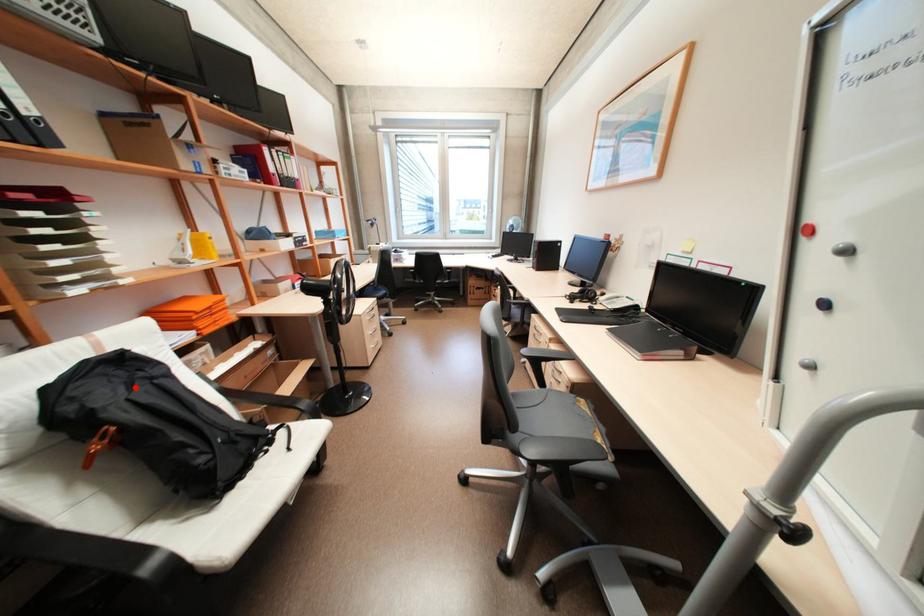
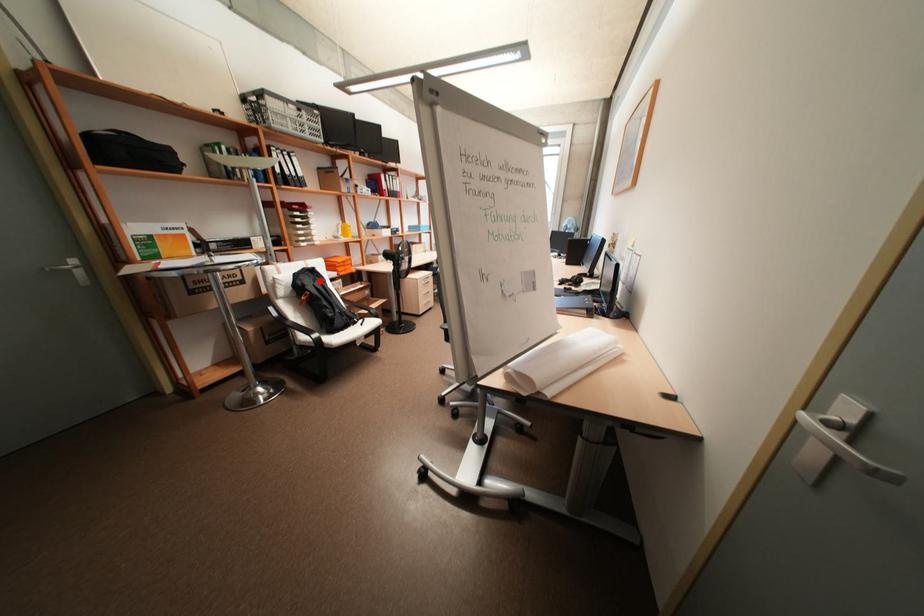
I am providing you with two images of the same scene from different viewpoints. A red point is marked on the first image and another point is marked on the second image. Is the red point in image1 aligned with the point shown in image2?

Yes